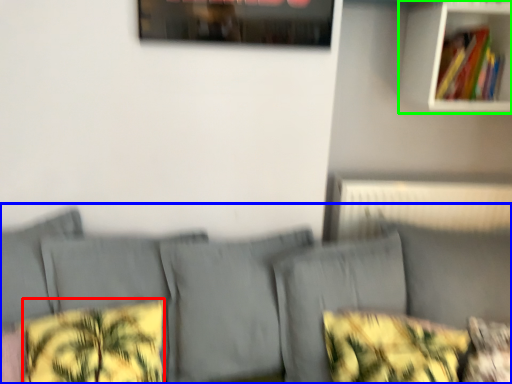
Question: Based on their relative distances, which object is farther from pillow (highlighted by a red box)? Choose from couch (highlighted by a blue box) and shelf (highlighted by a green box).

Choices:
 (A) couch
 (B) shelf

Answer: (B)